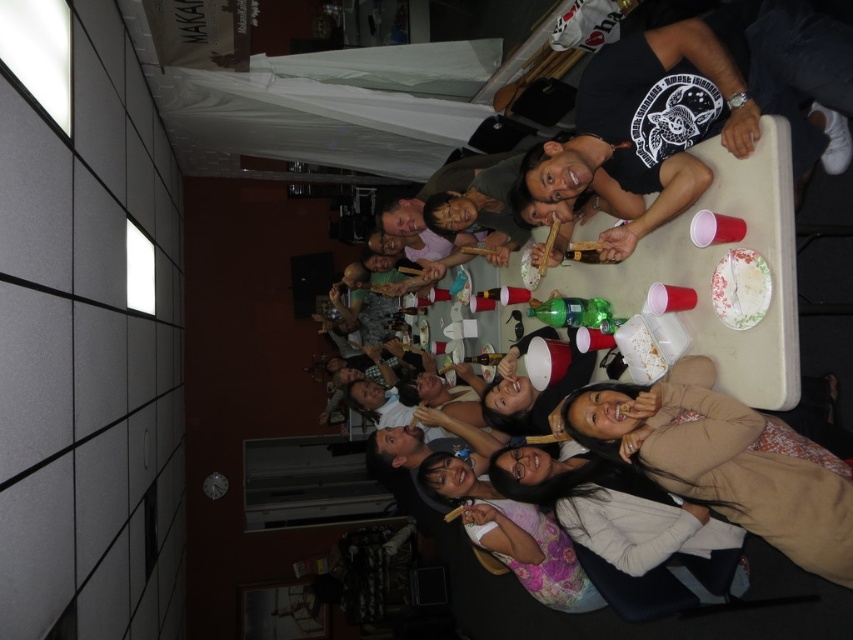
Question: Which point is farther from the camera taking this photo?

Choices:
 (A) (735, 275)
 (B) (769, 458)

Answer: (A)

Question: Which object is positioned closest to the floral paper plate at upper right?

Choices:
 (A) matte black t-shirt at upper right
 (B) light brown sweater at lower right

Answer: (B)

Question: Is matte black t-shirt at upper right bigger than floral paper plate at upper right?

Choices:
 (A) yes
 (B) no

Answer: (A)

Question: Is light brown sweater at lower right behind floral paper plate at upper right?

Choices:
 (A) no
 (B) yes

Answer: (A)

Question: Estimate the real-world distances between objects in this image. Which object is farther from the white paper plate at upper center?

Choices:
 (A) light brown sweater at lower right
 (B) floral paper plate at upper right
 (C) matte black t-shirt at upper right

Answer: (C)

Question: From the image, what is the correct spatial relationship of matte black t-shirt at upper right in relation to white paper plate at upper center?

Choices:
 (A) above
 (B) below

Answer: (A)